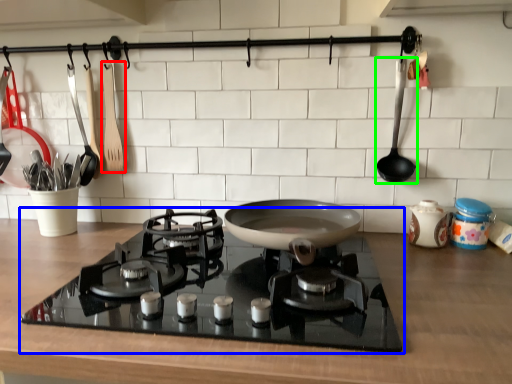
Question: Estimate the real-world distances between objects in this image. Which object is farther from kitchen appliance (highlighted by a red box), gas stove (highlighted by a blue box) or spoon (highlighted by a green box)?

Choices:
 (A) gas stove
 (B) spoon

Answer: (B)